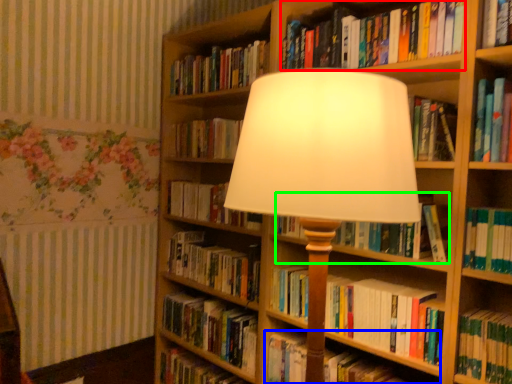
Question: Which is nearer to the book (highlighted by a red box)? book (highlighted by a blue box) or book (highlighted by a green box).

Choices:
 (A) book
 (B) book

Answer: (B)